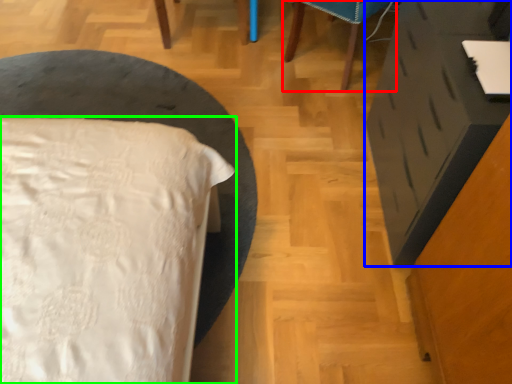
Question: Which object is positioned farthest from furniture (highlighted by a red box)? Select from vanity (highlighted by a blue box) and bed (highlighted by a green box).

Choices:
 (A) vanity
 (B) bed

Answer: (B)